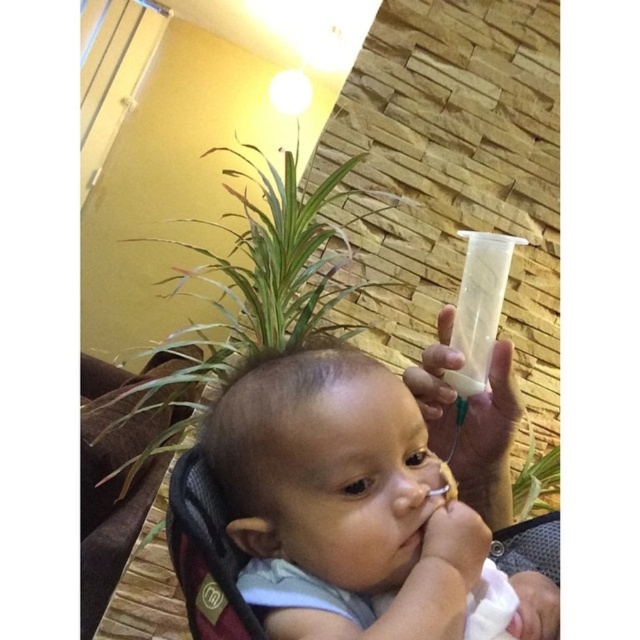
Question: Which point is closer to the camera?

Choices:
 (A) smooth plastic bottle at upper right
 (B) green leafy plant at center
 (C) green leafy plant at upper left

Answer: (A)

Question: Which point appears closest to the camera in this image?

Choices:
 (A) (244, 381)
 (B) (209, 252)

Answer: (A)

Question: Can you confirm if smooth plastic bottle at upper right is thinner than green leafy plant at center?

Choices:
 (A) yes
 (B) no

Answer: (B)

Question: Can you confirm if smooth plastic bottle at upper right is positioned above green leafy plant at upper left?

Choices:
 (A) no
 (B) yes

Answer: (A)

Question: Which object appears closest to the camera in this image?

Choices:
 (A) green leafy plant at upper left
 (B) smooth plastic bottle at upper right
 (C) green leafy plant at center

Answer: (B)

Question: Does smooth plastic bottle at upper right have a lesser width compared to green leafy plant at center?

Choices:
 (A) no
 (B) yes

Answer: (A)